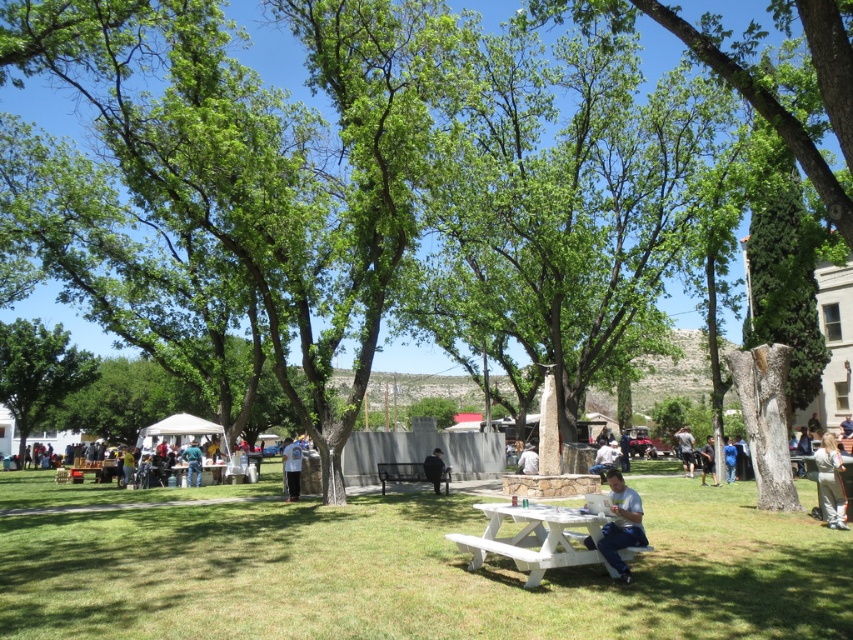
You are standing in the park and want to walk from the green grass at lower center to the white plastic picnic table at center. Which direction should you move to get closer to the picnic table?

You should move away from the green grass at lower center towards the white plastic picnic table at center since the picnic table is further away from the viewer than the grass.

You are planning to set up a small tent in the park. You see the green grass at lower center and the white plastic picnic table at center. Which area has more space to accommodate the tent?

The green grass at lower center has more space to accommodate the tent since it is bigger than the white plastic picnic table at center.